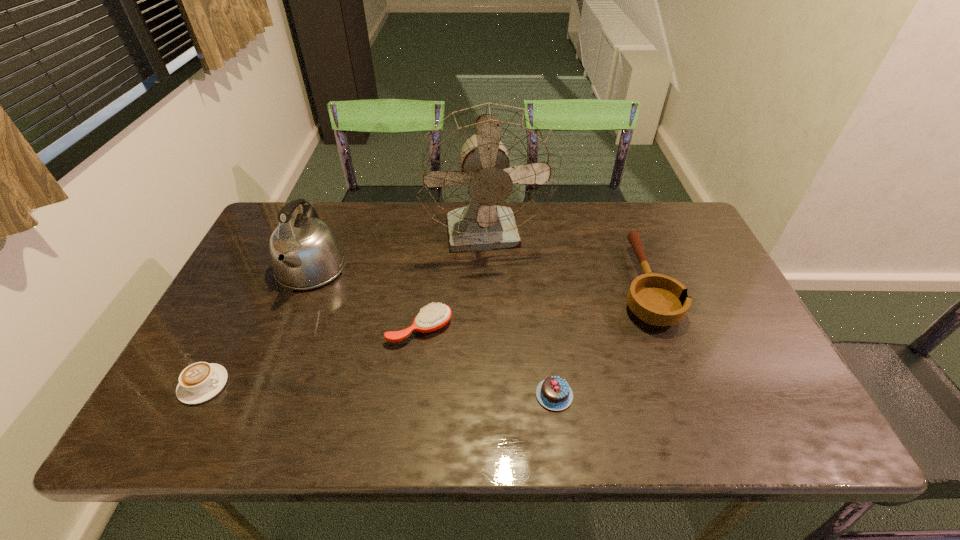
Find the location of a particular element. Image resolution: width=960 pixels, height=540 pixels. fan is located at coordinates (484, 171).

Where is `kettle`? The width and height of the screenshot is (960, 540). kettle is located at coordinates (305, 253).

Locate an element on the screen. The image size is (960, 540). the rightmost object is located at coordinates (656, 299).

The width and height of the screenshot is (960, 540). Identify the location of the third tallest object. (656, 299).

The width and height of the screenshot is (960, 540). I want to click on hairbrush, so click(433, 317).

Identify the location of cappuccino. This screenshot has width=960, height=540. (199, 382).

Image resolution: width=960 pixels, height=540 pixels. Find the location of `chocolate cake`. chocolate cake is located at coordinates (554, 393).

This screenshot has width=960, height=540. In order to click on free spot located 0.220m in front of the tallest object to blow air in this screenshot , I will do `click(488, 328)`.

Find the location of a particular element. The width and height of the screenshot is (960, 540). vacant space located on the spout of the kettle is located at coordinates (277, 352).

Locate an element on the screen. The image size is (960, 540). vacant point located 0.100m with the handle on the side of the rightmost object is located at coordinates (621, 226).